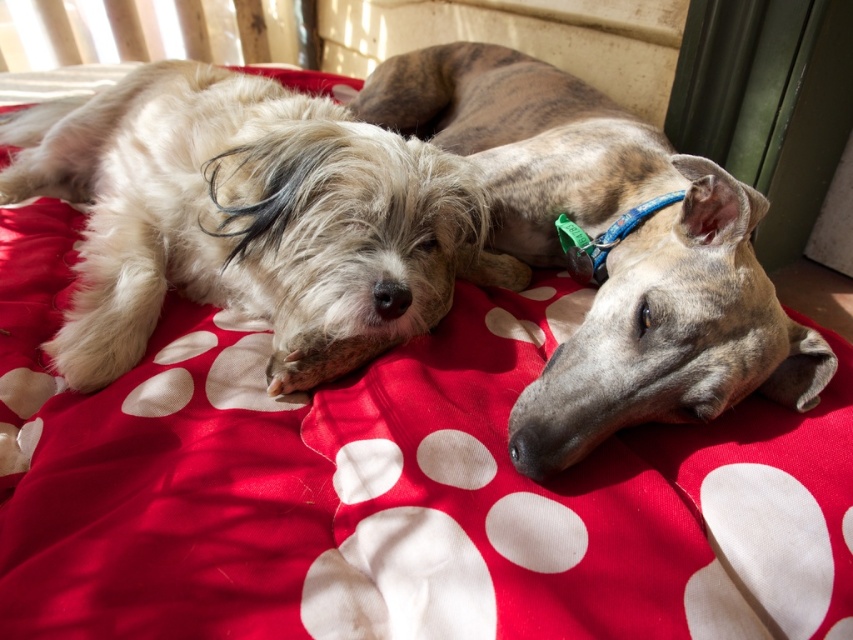
Question: Is shaggy beige dog at left to the right of speckled fur dog at center from the viewer's perspective?

Choices:
 (A) no
 (B) yes

Answer: (A)

Question: Is shaggy beige dog at left closer to the viewer compared to speckled fur dog at center?

Choices:
 (A) yes
 (B) no

Answer: (B)

Question: Which point is closer to the camera?

Choices:
 (A) (624, 337)
 (B) (410, 252)

Answer: (A)

Question: Among these points, which one is nearest to the camera?

Choices:
 (A) (749, 268)
 (B) (403, 317)

Answer: (A)

Question: Which of the following is the farthest from the observer?

Choices:
 (A) speckled fur dog at center
 (B) shaggy beige dog at left

Answer: (B)

Question: Does shaggy beige dog at left lie behind speckled fur dog at center?

Choices:
 (A) yes
 (B) no

Answer: (A)